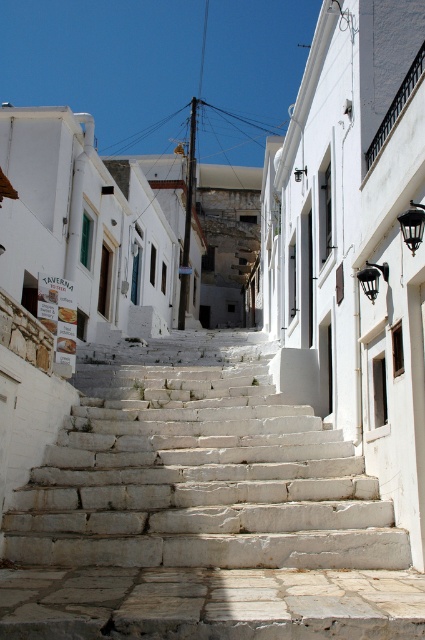
You are standing at the entrance of the street and want to reach the top of the white stone stairs at center. Which direction should you move in to climb them?

The white stone stairs at center are located at point (198,468) in the image, so you should move towards the center of the image to climb them.

You are a tourist carrying a large backpack and need to climb the white stone stairs at center. The black metal balustrade at upper right is nearby. Which object would you hold onto for support while climbing the stairs?

You should hold onto the black metal balustrade at upper right for support since it is a smaller structure and easier to grip compared to the larger white stone stairs at center.

You are standing at the bottom of the street and want to climb the stairs to reach the upper part of the street. Which object should you approach first, the white stone stairs at center or the black metal balustrade at upper right?

You should approach the white stone stairs at center first because it is located to the left of the black metal balustrade at upper right, making it closer to your starting position at the bottom of the street.